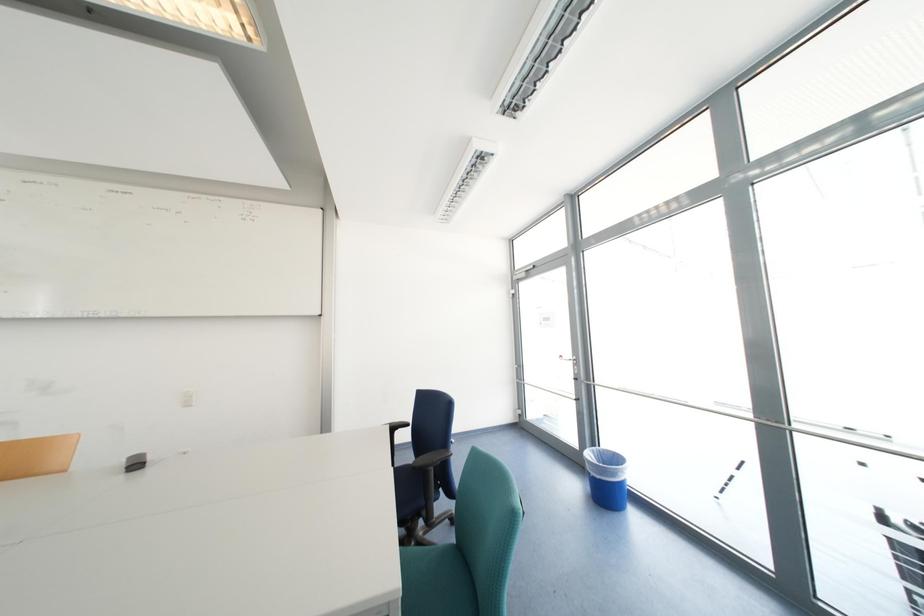
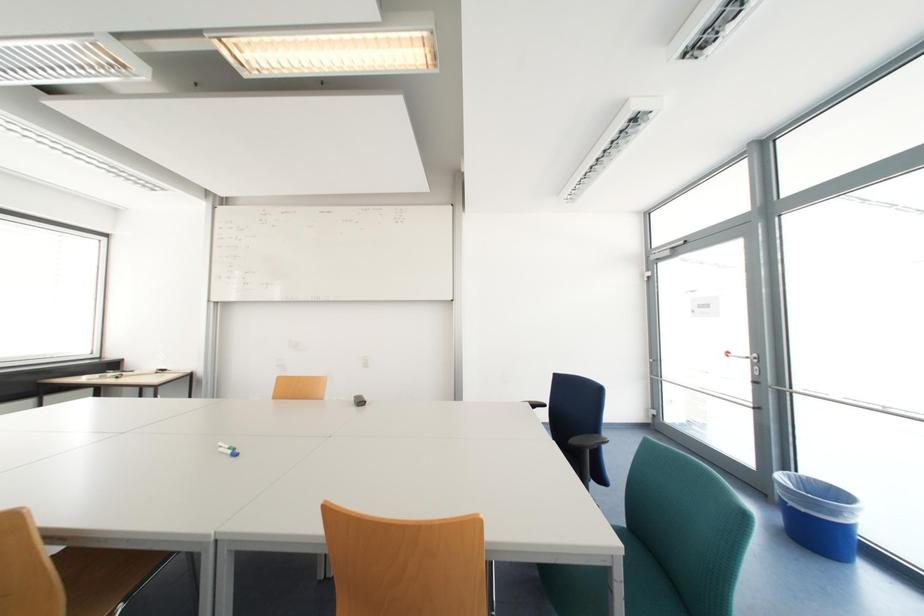
Which direction would the cameraman need to move to produce the second image?

The movement direction of the cameraman is left, backward.